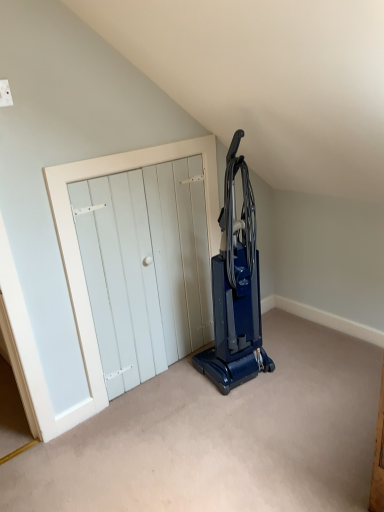
Where is `white wooden door at center`? The height and width of the screenshot is (512, 384). white wooden door at center is located at coordinates (141, 268).

What do you see at coordinates (141, 268) in the screenshot?
I see `white wooden door at center` at bounding box center [141, 268].

Describe the element at coordinates (235, 289) in the screenshot. I see `blue plastic vacuum cleaner at center` at that location.

Where is `blue plastic vacuum cleaner at center`? This screenshot has height=512, width=384. blue plastic vacuum cleaner at center is located at coordinates (235, 289).

What is the approximate height of blue plastic vacuum cleaner at center?

1.16 meters.

Identify the location of white wooden door at center. (141, 268).

Does blue plastic vacuum cleaner at center appear on the left side of white wooden door at center?

No.

Is blue plastic vacuum cleaner at center in front of or behind white wooden door at center in the image?

In the image, blue plastic vacuum cleaner at center appears in front of white wooden door at center.

Which is in front, point (242, 262) or point (132, 378)?

Point (242, 262)

From the image's perspective, which is below, blue plastic vacuum cleaner at center or white wooden door at center?

white wooden door at center, from the image's perspective.

Based on the photo, from a real-world perspective, who is located lower, blue plastic vacuum cleaner at center or white wooden door at center?

white wooden door at center is physically lower.

Considering the sizes of blue plastic vacuum cleaner at center and white wooden door at center in the image, is blue plastic vacuum cleaner at center wider or thinner than white wooden door at center?

blue plastic vacuum cleaner at center is wider than white wooden door at center.

Which of these two, blue plastic vacuum cleaner at center or white wooden door at center, stands shorter?

With less height is white wooden door at center.

Between blue plastic vacuum cleaner at center and white wooden door at center, which one has larger size?

With larger size is blue plastic vacuum cleaner at center.

Is white wooden door at center located within blue plastic vacuum cleaner at center?

No, white wooden door at center is located outside of blue plastic vacuum cleaner at center.

Are blue plastic vacuum cleaner at center and white wooden door at center located far from each other?

They are positioned close to each other.

Is white wooden door at center at the back of blue plastic vacuum cleaner at center?

Yes, white wooden door at center is at the back of blue plastic vacuum cleaner at center.

How different are the orientations of blue plastic vacuum cleaner at center and white wooden door at center in degrees?

They differ by 4.49 degrees in their facing directions.

The width and height of the screenshot is (384, 512). Find the location of `door on the left side of blue plastic vacuum cleaner at center`. door on the left side of blue plastic vacuum cleaner at center is located at coordinates (141, 268).

Would you say white wooden door at center is to the left or to the right of blue plastic vacuum cleaner at center in the picture?

white wooden door at center is to the left of blue plastic vacuum cleaner at center.

Is the depth of white wooden door at center greater than that of blue plastic vacuum cleaner at center?

Yes, white wooden door at center is further from the camera.

Between point (155, 266) and point (256, 251), which one is positioned in front?

The point (256, 251) is closer.

From the image's perspective, is white wooden door at center above or below blue plastic vacuum cleaner at center?

From the image's perspective, white wooden door at center appears below blue plastic vacuum cleaner at center.

From a real-world perspective, between white wooden door at center and blue plastic vacuum cleaner at center, who is vertically lower?

white wooden door at center is physically lower.

Looking at their sizes, would you say white wooden door at center is wider or thinner than blue plastic vacuum cleaner at center?

In the image, white wooden door at center appears to be more narrow than blue plastic vacuum cleaner at center.

Can you confirm if white wooden door at center is shorter than blue plastic vacuum cleaner at center?

Yes, white wooden door at center is shorter than blue plastic vacuum cleaner at center.

Can you confirm if white wooden door at center is smaller than blue plastic vacuum cleaner at center?

Yes, white wooden door at center is smaller than blue plastic vacuum cleaner at center.

Is white wooden door at center inside the boundaries of blue plastic vacuum cleaner at center, or outside?

white wooden door at center is located beyond the bounds of blue plastic vacuum cleaner at center.

Is white wooden door at center far away from blue plastic vacuum cleaner at center?

No, white wooden door at center is not far from blue plastic vacuum cleaner at center.

Is blue plastic vacuum cleaner at center at the back of white wooden door at center?

Yes.

Can you tell me how much white wooden door at center and blue plastic vacuum cleaner at center differ in facing direction?

4.49 degrees separate the facing orientations of white wooden door at center and blue plastic vacuum cleaner at center.

How much distance is there between white wooden door at center and blue plastic vacuum cleaner at center?

white wooden door at center is 13.25 inches from blue plastic vacuum cleaner at center.

Identify the location of door behind the blue plastic vacuum cleaner at center. (141, 268).

Locate an element on the screen. Image resolution: width=384 pixels, height=512 pixels. home appliance that appears above the white wooden door at center (from a real-world perspective) is located at coordinates (235, 289).

This screenshot has width=384, height=512. What are the coordinates of `home appliance located in front of the white wooden door at center` in the screenshot? It's located at (235, 289).